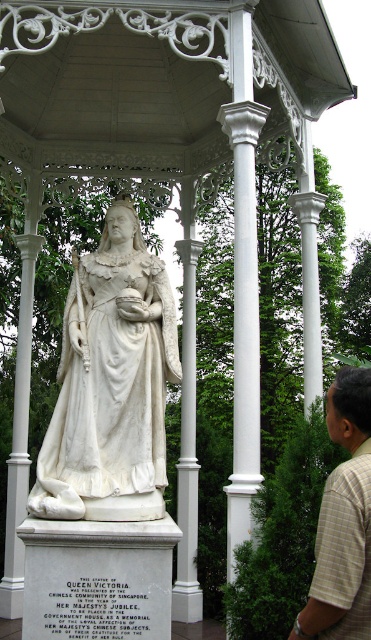
Can you confirm if white marble statue at center is positioned below light brown plaid shirt at lower right?

Result: No, white marble statue at center is not below light brown plaid shirt at lower right.

From the picture: Does white marble statue at center lie in front of light brown plaid shirt at lower right?

No, white marble statue at center is behind light brown plaid shirt at lower right.

You are a GUI agent. You are given a task and a screenshot of the screen. Output one action in this format:
    pyautogui.click(x=<x>, y=<y>)
    Task: Click on the white marble statue at center
    Image resolution: width=371 pixels, height=640 pixels.
    Given the screenshot: What is the action you would take?
    pyautogui.click(x=110, y=385)

Find the location of a particular element. white marble statue at center is located at coordinates (110, 385).

Is point (244, 24) more distant than point (352, 499)?

Yes, point (244, 24) is farther from viewer.

Based on the photo, does white marble column at center have a greater width compared to light brown plaid shirt at lower right?

Yes.

Does point (254, 234) come closer to viewer compared to point (330, 566)?

No, it is not.

This screenshot has height=640, width=371. What are the coordinates of `white marble column at center` in the screenshot? It's located at (244, 280).

Locate an element on the screen. Image resolution: width=371 pixels, height=640 pixels. white marble statue at center is located at coordinates (110, 385).

At what (x,y) coordinates should I click in order to perform the action: click on white marble statue at center. Please return your answer as a coordinate pair (x, y). This screenshot has height=640, width=371. Looking at the image, I should click on (110, 385).